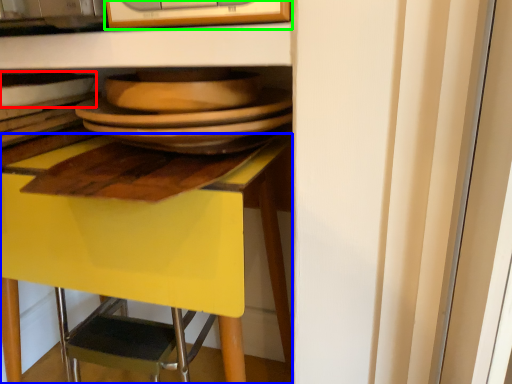
Question: Estimate the real-world distances between objects in this image. Which object is closer to tableware (highlighted by a red box), desk (highlighted by a blue box) or appliance (highlighted by a green box)?

Choices:
 (A) desk
 (B) appliance

Answer: (B)